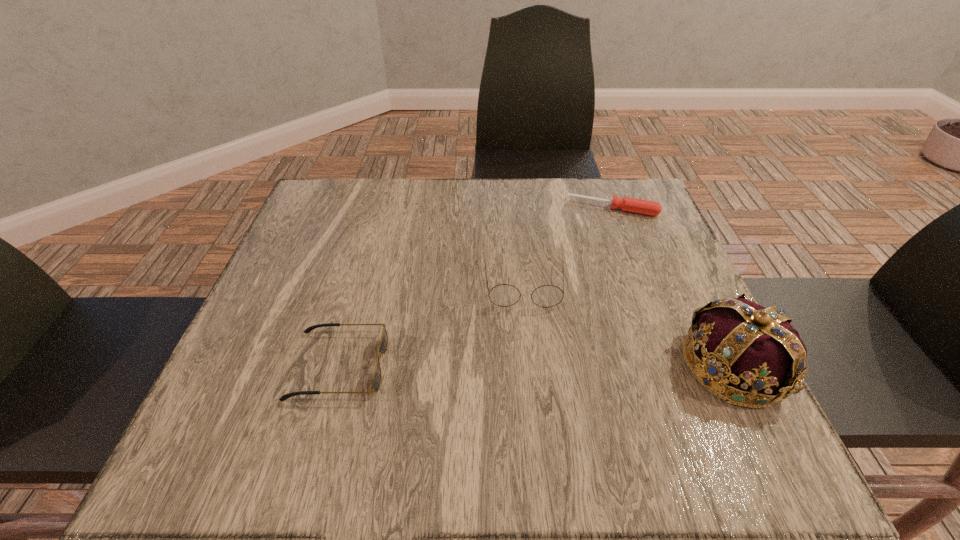
Where is `sunglasses`? sunglasses is located at coordinates (383, 346).

I want to click on the second shortest object, so click(x=383, y=346).

Where is `crown`? The height and width of the screenshot is (540, 960). crown is located at coordinates (751, 356).

This screenshot has width=960, height=540. What are the coordinates of `the farthest object` in the screenshot? It's located at (645, 207).

This screenshot has height=540, width=960. Identify the location of screwdriver. (645, 207).

Locate an element on the screen. Image resolution: width=960 pixels, height=540 pixels. spectacles is located at coordinates (504, 295).

You are a GUI agent. You are given a task and a screenshot of the screen. Output one action in this format:
    pyautogui.click(x=<x>, y=<y>)
    Task: Click on the second farthest object
    Image resolution: width=960 pixels, height=540 pixels.
    Given the screenshot: What is the action you would take?
    pyautogui.click(x=504, y=295)

Image resolution: width=960 pixels, height=540 pixels. Identify the location of free spot located 0.320m on the front-facing side of the leftmost object. [564, 365].

The width and height of the screenshot is (960, 540). Find the location of `vacant space located 0.090m on the back of the crown`. vacant space located 0.090m on the back of the crown is located at coordinates (698, 293).

The height and width of the screenshot is (540, 960). I want to click on vacant space located at the blade of the screwdriver, so click(597, 247).